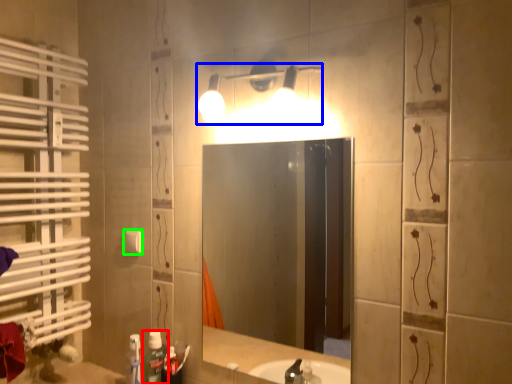
Question: Which is farther away from bottle (highlighted by a red box)? light fixture (highlighted by a blue box) or light switch (highlighted by a green box)?

Choices:
 (A) light fixture
 (B) light switch

Answer: (A)